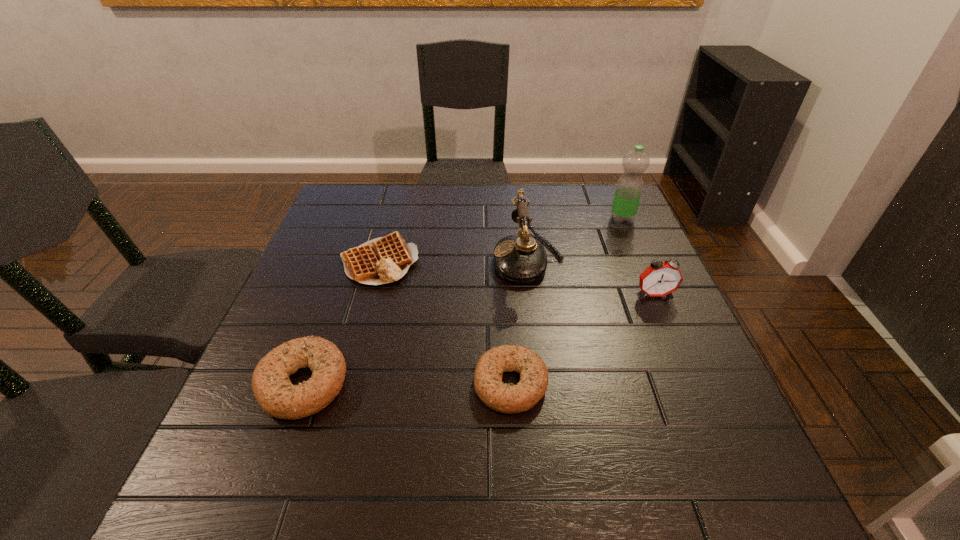
This screenshot has width=960, height=540. Identify the location of free space located 0.170m on the dial of the fifth shortest object. (428, 259).

Locate an element on the screen. The width and height of the screenshot is (960, 540). vacant space situated 0.240m on the dial of the fifth shortest object is located at coordinates (401, 259).

The height and width of the screenshot is (540, 960). I want to click on vacant position located 0.380m on the dial of the fifth shortest object, so click(x=348, y=259).

Locate an element on the screen. free spot located 0.100m on the front of the waffle is located at coordinates (364, 319).

At what (x,y) coordinates should I click in order to perform the action: click on blank space located on the front of the water bottle. Please return your answer as a coordinate pair (x, y). Looking at the image, I should click on (665, 320).

I want to click on blank space located on the clock face of the alarm clock, so click(679, 350).

In order to click on object at the far edge in this screenshot , I will do `click(629, 187)`.

The height and width of the screenshot is (540, 960). Identify the location of bagel at the left edge. click(276, 395).

I want to click on waffle situated at the left edge, so click(x=383, y=260).

Find the location of `water bottle that is at the right edge`. water bottle that is at the right edge is located at coordinates (629, 187).